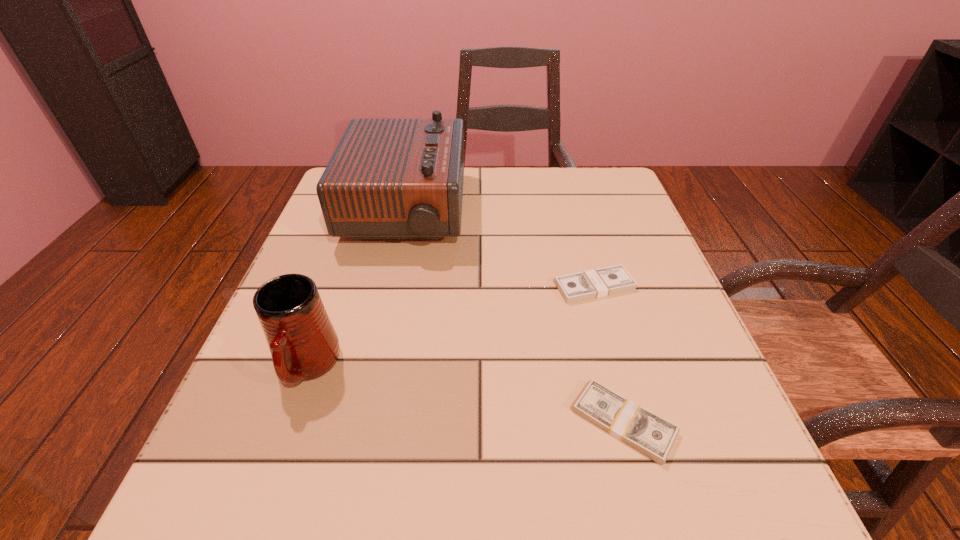
This screenshot has width=960, height=540. I want to click on blank space that satisfies the following two spatial constraints: 1. on the back side of the farther dollar; 2. on the front panel of the farthest object, so click(x=573, y=211).

Where is `free space that satisfies the following two spatial constraints: 1. on the side of the mug with the handle; 2. on the left side of the nearer dollar`? free space that satisfies the following two spatial constraints: 1. on the side of the mug with the handle; 2. on the left side of the nearer dollar is located at coordinates (288, 422).

The image size is (960, 540). I want to click on free space that satisfies the following two spatial constraints: 1. on the back side of the nearer dollar; 2. on the front panel of the farthest object, so click(x=567, y=211).

Identify the location of vacant space that satisfies the following two spatial constraints: 1. on the front panel of the radio receiver; 2. on the side of the mug with the handle. (371, 367).